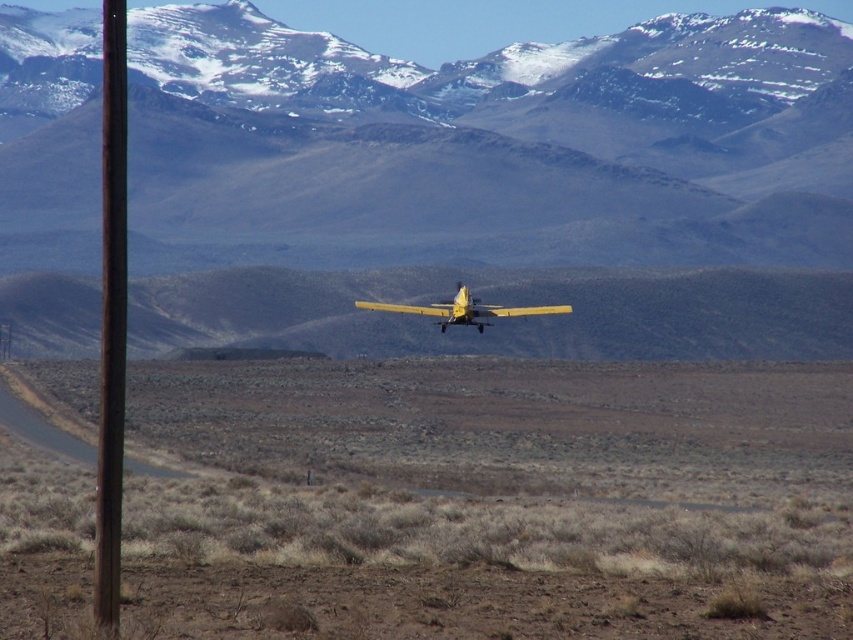
Between brown dirt at center and rusty metal pole at left, which one appears on the right side from the viewer's perspective?

From the viewer's perspective, brown dirt at center appears more on the right side.

This screenshot has width=853, height=640. What do you see at coordinates (489, 500) in the screenshot?
I see `brown dirt at center` at bounding box center [489, 500].

This screenshot has width=853, height=640. What are the coordinates of `brown dirt at center` in the screenshot? It's located at (489, 500).

Who is taller, brown dirt at center or yellow matte airplane at center?

brown dirt at center

Is brown dirt at center positioned in front of yellow matte airplane at center?

Yes.

At what (x,y) coordinates should I click in order to perform the action: click on brown dirt at center. Please return your answer as a coordinate pair (x, y). The image size is (853, 640). Looking at the image, I should click on (489, 500).

Is snowy rock mountain range at upper center bigger than yellow matte airplane at center?

→ Yes, snowy rock mountain range at upper center is bigger than yellow matte airplane at center.

Does snowy rock mountain range at upper center appear on the left side of yellow matte airplane at center?

In fact, snowy rock mountain range at upper center is to the right of yellow matte airplane at center.

Find the location of a particular element. The height and width of the screenshot is (640, 853). snowy rock mountain range at upper center is located at coordinates (492, 188).